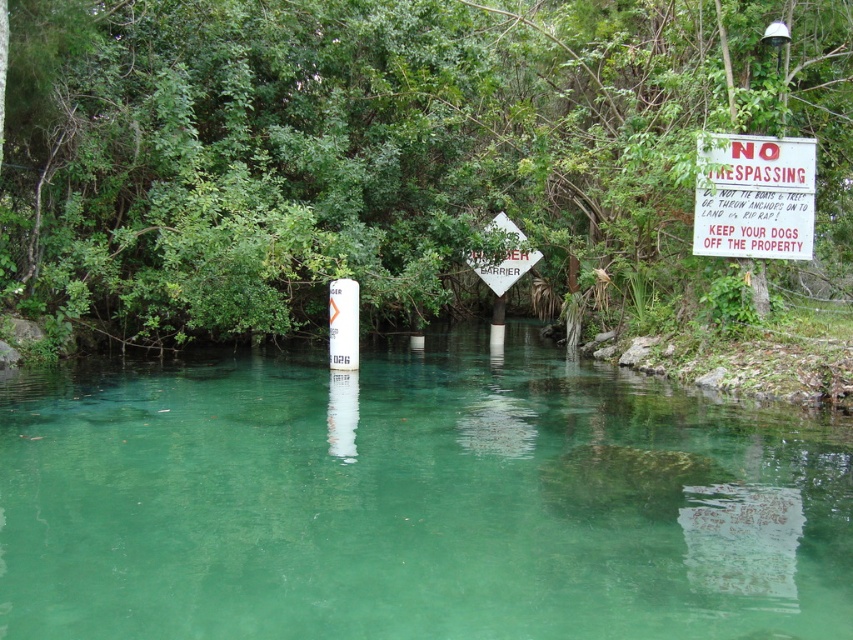
You are a hiker who wants to cross the green translucent water at center. There is a red plastic sign at upper right nearby. What does the sign likely indicate about the water?

The red plastic sign at upper right is above the green translucent water at center, so it likely indicates a warning or information about the water below.